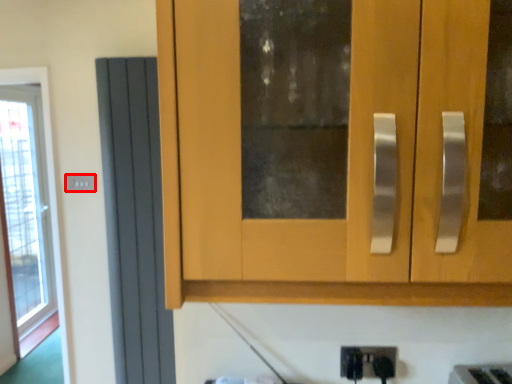
Question: In this image, where is electric outlet (annotated by the red box) located relative to screen door?

Choices:
 (A) left
 (B) right

Answer: (A)